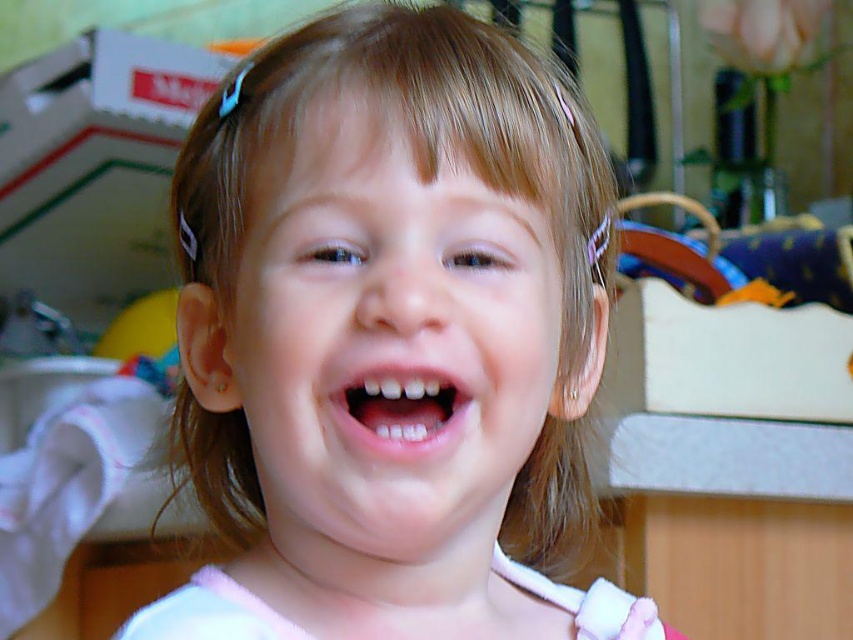
You are a photographer adjusting the camera focus. You notice two pink items in the frame, the pink fabric at center and the pink glossy lips at center. Which one is wider?

The pink fabric at center is wider than the pink glossy lips at center.

What is the color of the fabric located at the coordinates point [390,333] in the image?

The fabric at point [390,333] is pink.

You are a photographer adjusting the camera focus. The subject is the child with pink fabric at center and pink glossy lips at center. To ensure both objects are in focus, what is the minimum distance the camera should be set to? Assume the depth of field requires objects to be within 4 inches of each other to be in focus.

The pink fabric at center and pink glossy lips at center are 4.24 inches apart. Since the required depth of field is 4 inches, the camera should be set to a distance that allows both objects within 4 inches. However, since they are 4.24 inches apart, which exceeds the 4 inch limit, the photographer may need to adjust the focus or use a different setting to ensure both are in focus.